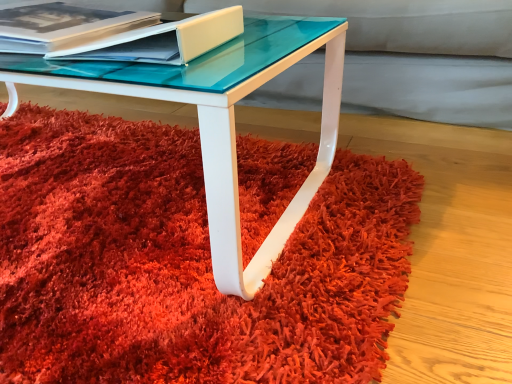
Question: From a real-world perspective, is matte white book at upper left, the second paperback book positioned from the left, above or below matte white book at upper left, the 1th paperback book viewed from the left?

Choices:
 (A) below
 (B) above

Answer: (B)

Question: In terms of width, does matte white book at upper left, the second paperback book positioned from the left, look wider or thinner when compared to matte white book at upper left, the 1th paperback book viewed from the left?

Choices:
 (A) thin
 (B) wide

Answer: (A)

Question: Which is nearer to the matte white book at upper left, which ranks as the second paperback book in right-to-left order?

Choices:
 (A) shaggy red carpet at lower center
 (B) matte white book at upper left, marked as the first paperback book in a right-to-left arrangement

Answer: (B)

Question: Considering the real-world distances, which object is farthest from the shaggy red carpet at lower center?

Choices:
 (A) matte white book at upper left, which ranks as the second paperback book in right-to-left order
 (B) matte white book at upper left, marked as the first paperback book in a right-to-left arrangement

Answer: (A)